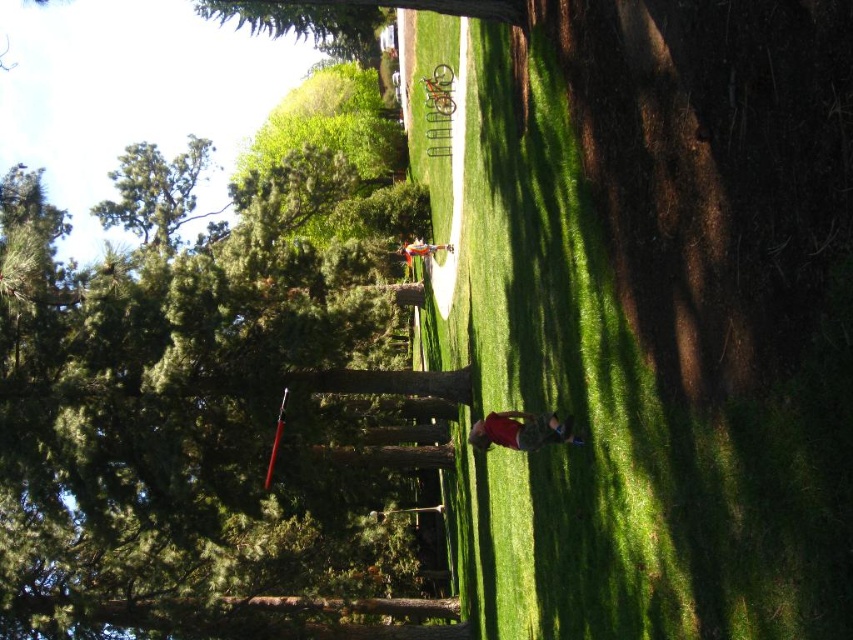
Question: Observing the image, what is the correct spatial positioning of green textured tree at upper left in reference to matte white shirt at center?

Choices:
 (A) right
 (B) left

Answer: (B)

Question: Estimate the real-world distances between objects in this image. Which object is closer to the matte white shirt at center?

Choices:
 (A) red cotton shirt at lower center
 (B) green textured tree at upper left

Answer: (B)

Question: Which point appears closest to the camera in this image?

Choices:
 (A) (285, 332)
 (B) (534, 442)

Answer: (B)

Question: Which point is farther to the camera?

Choices:
 (A) (270, 412)
 (B) (422, 244)
 (C) (572, 436)

Answer: (B)

Question: Is green textured tree at upper left in front of matte white shirt at center?

Choices:
 (A) yes
 (B) no

Answer: (A)

Question: Does green textured tree at upper left have a lesser width compared to matte white shirt at center?

Choices:
 (A) no
 (B) yes

Answer: (A)